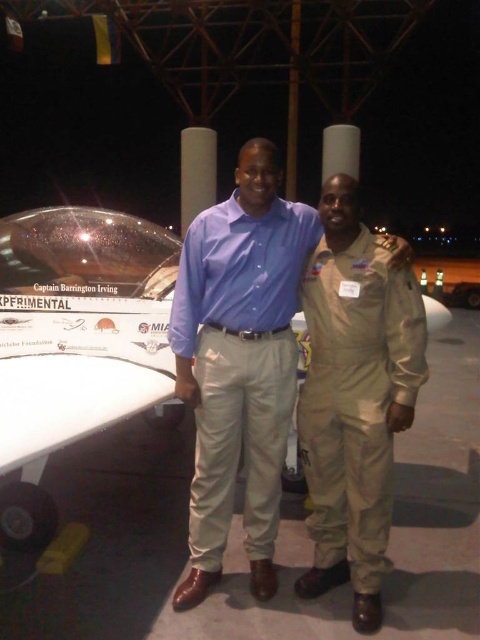
You are a photographer at the airfield and need to capture a photo that includes both the white glossy airplane at center and the matte blue shirt at center. Given their sizes, which object should you position closer to the camera to ensure both fit in the frame?

Since the white glossy airplane at center is wider than the matte blue shirt at center, you should position the matte blue shirt at center closer to the camera to ensure both fit within the frame.